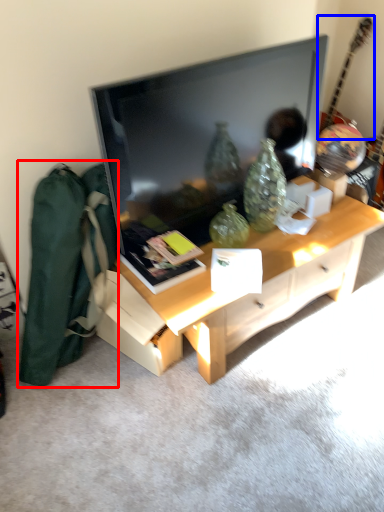
Question: Which object is closer to the camera taking this photo, messenger bag (highlighted by a red box) or guitar (highlighted by a blue box)?

Choices:
 (A) messenger bag
 (B) guitar

Answer: (A)